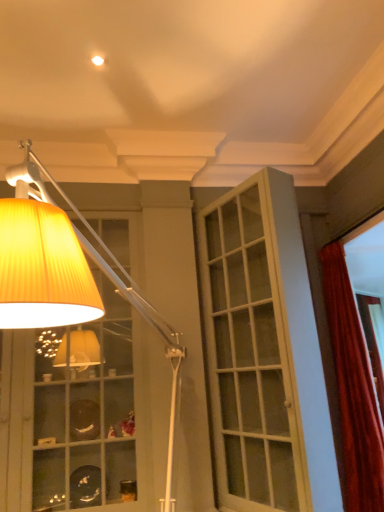
This screenshot has height=512, width=384. I want to click on yellow pleated lampshade at upper left, so click(69, 347).

The width and height of the screenshot is (384, 512). I want to click on white glass door at center, so click(251, 354).

The height and width of the screenshot is (512, 384). What are the coordinates of `curtain located below the yellow pleated lampshade at upper left (from the image's perspective)` in the screenshot? It's located at (353, 389).

Could yellow pleated lampshade at upper left be considered to be inside velvet red curtain at right?

No, yellow pleated lampshade at upper left is not a part of velvet red curtain at right.

How much distance is there between velvet red curtain at right and yellow pleated lampshade at upper left?

velvet red curtain at right is 1.73 meters away from yellow pleated lampshade at upper left.

Is point (351, 404) more distant than point (33, 282)?

Yes, point (351, 404) is behind point (33, 282).

From the image's perspective, is yellow pleated lampshade at upper left over velvet red curtain at right?

Yes, from the image's perspective, yellow pleated lampshade at upper left is on top of velvet red curtain at right.

The height and width of the screenshot is (512, 384). I want to click on lamp that appears on the left of velvet red curtain at right, so click(x=69, y=347).

Are yellow pleated lampshade at upper left and velvet red curtain at right beside each other?

There is a gap between yellow pleated lampshade at upper left and velvet red curtain at right.

Which object is thinner, yellow pleated lampshade at upper left or velvet red curtain at right?

With smaller width is velvet red curtain at right.

Considering the relative sizes of velvet red curtain at right and white glass door at center in the image provided, is velvet red curtain at right thinner than white glass door at center?

No, velvet red curtain at right is not thinner than white glass door at center.

Is velvet red curtain at right oriented towards white glass door at center?

Yes, velvet red curtain at right is turned towards white glass door at center.

Between velvet red curtain at right and white glass door at center, which one has more height?

white glass door at center.

Image resolution: width=384 pixels, height=512 pixels. I want to click on screen door above the velvet red curtain at right (from a real-world perspective), so [x=251, y=354].

From a real-world perspective, which object rests below the other?

velvet red curtain at right, from a real-world perspective.

Is white glass door at center positioned with its back to velvet red curtain at right?

Yes, white glass door at center's orientation is away from velvet red curtain at right.

Based on the photo, is white glass door at center far away from velvet red curtain at right?

That's not correct — white glass door at center is a little close to velvet red curtain at right.

Between white glass door at center and velvet red curtain at right, which one has larger width?

velvet red curtain at right is wider.

From a real-world perspective, which object rests below the other?

yellow pleated lampshade at upper left is physically lower.

Can you confirm if yellow pleated lampshade at upper left is smaller than white glass door at center?

Actually, yellow pleated lampshade at upper left might be larger than white glass door at center.

Considering the relative positions of yellow pleated lampshade at upper left and white glass door at center in the image provided, is yellow pleated lampshade at upper left to the left of white glass door at center from the viewer's perspective?

Correct, you'll find yellow pleated lampshade at upper left to the left of white glass door at center.

Can we say yellow pleated lampshade at upper left lies outside white glass door at center?

Yes, yellow pleated lampshade at upper left is outside of white glass door at center.

Is white glass door at center smaller than yellow pleated lampshade at upper left?

Yes.

How far apart are white glass door at center and yellow pleated lampshade at upper left?

white glass door at center and yellow pleated lampshade at upper left are 94.65 centimeters apart from each other.

Which object is positioned more to the left, white glass door at center or yellow pleated lampshade at upper left?

yellow pleated lampshade at upper left is more to the left.

Would you say white glass door at center is inside or outside yellow pleated lampshade at upper left?

The correct answer is: outside.

I want to click on curtain on the right of yellow pleated lampshade at upper left, so click(x=353, y=389).

Locate an element on the screen. curtain located underneath the yellow pleated lampshade at upper left (from a real-world perspective) is located at coordinates (353, 389).

From the image, which object appears to be nearer to yellow pleated lampshade at upper left, white glass door at center or velvet red curtain at right?

white glass door at center.

Estimate the real-world distances between objects in this image. Which object is further from white glass door at center, velvet red curtain at right or yellow pleated lampshade at upper left?

Based on the image, yellow pleated lampshade at upper left appears to be further to white glass door at center.

Which object lies nearer to the anchor point white glass door at center, yellow pleated lampshade at upper left or velvet red curtain at right?

velvet red curtain at right.

Which object lies nearer to the anchor point velvet red curtain at right, white glass door at center or yellow pleated lampshade at upper left?

white glass door at center is closer to velvet red curtain at right.

Estimate the real-world distances between objects in this image. Which object is closer to velvet red curtain at right, yellow pleated lampshade at upper left or white glass door at center?

white glass door at center lies closer to velvet red curtain at right than the other object.

Looking at the image, which one is located closer to yellow pleated lampshade at upper left, velvet red curtain at right or white glass door at center?

The object closer to yellow pleated lampshade at upper left is white glass door at center.

Where is `screen door between yellow pleated lampshade at upper left and velvet red curtain at right in the front-back direction`? This screenshot has width=384, height=512. screen door between yellow pleated lampshade at upper left and velvet red curtain at right in the front-back direction is located at coordinates (251, 354).